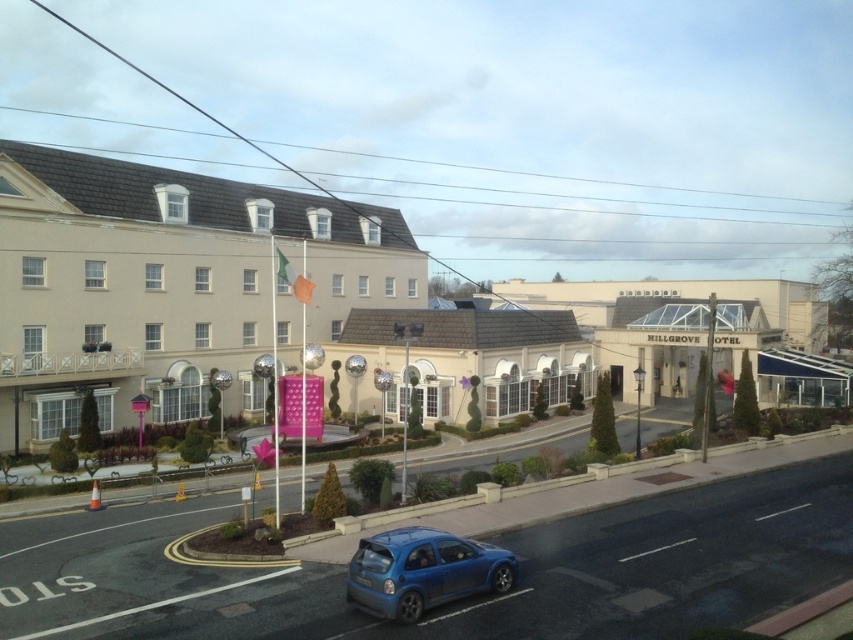
Who is positioned more to the right, beige stone building at upper left or metallic blue hatchback at lower center?

From the viewer's perspective, metallic blue hatchback at lower center appears more on the right side.

Does beige stone building at upper left appear on the left side of metallic blue hatchback at lower center?

Indeed, beige stone building at upper left is positioned on the left side of metallic blue hatchback at lower center.

Where is `beige stone building at upper left`? beige stone building at upper left is located at coordinates (164, 284).